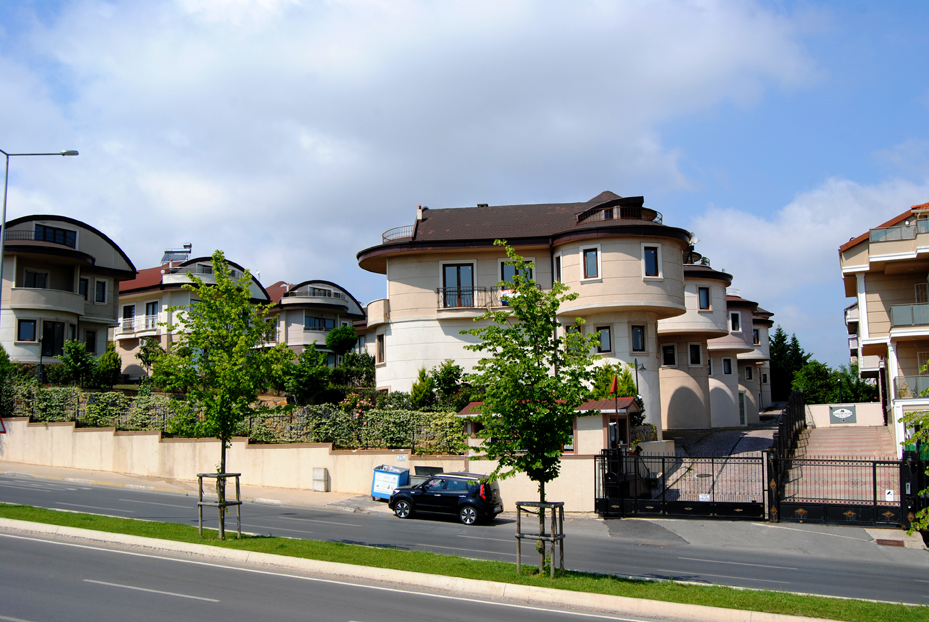
The width and height of the screenshot is (929, 622). I want to click on stairs, so click(x=830, y=440).